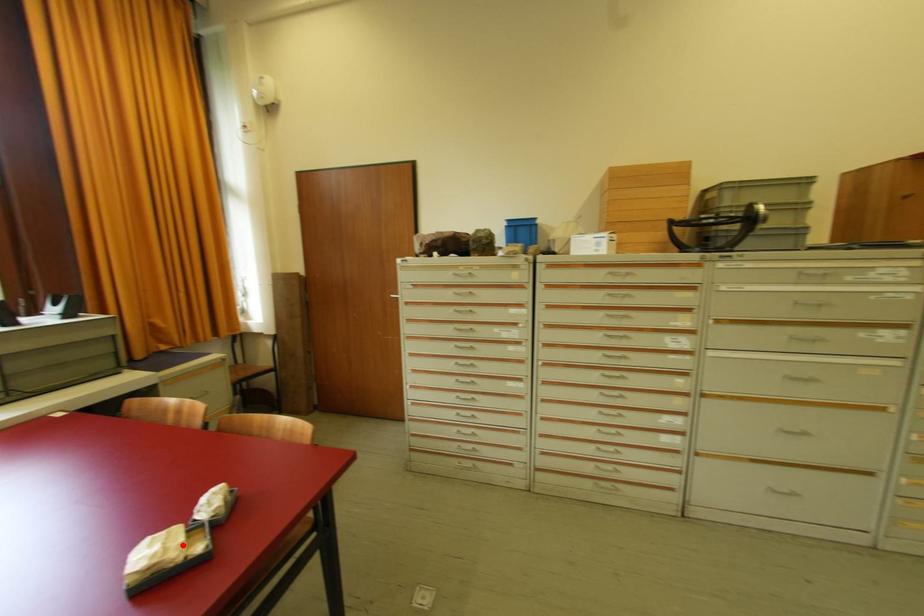
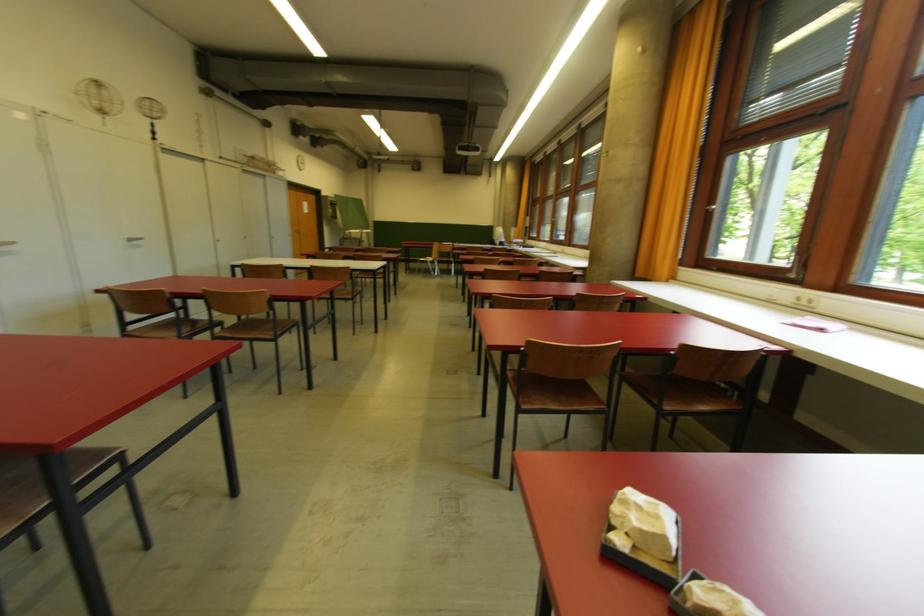
Find the pixel in the second image that matches the highlighted location in the first image.

(633, 522)